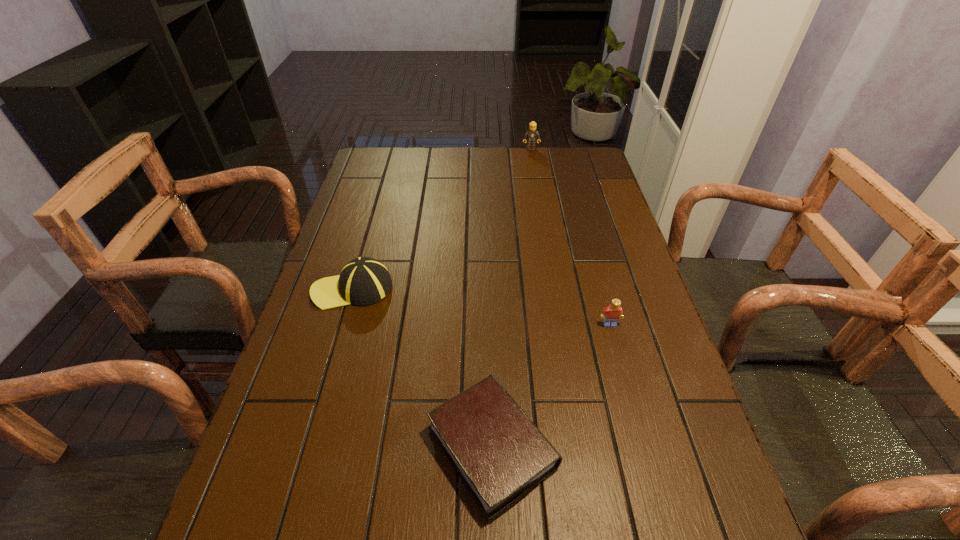
Find the location of a particular element. The width and height of the screenshot is (960, 540). blank space located 0.330m on the back of the third object from right to left is located at coordinates (489, 281).

This screenshot has height=540, width=960. What are the coordinates of `object situated at the far edge` in the screenshot? It's located at (531, 135).

The image size is (960, 540). I want to click on object at the left edge, so click(363, 281).

Locate an element on the screen. This screenshot has width=960, height=540. object situated at the right edge is located at coordinates (611, 314).

The width and height of the screenshot is (960, 540). I want to click on vacant area at the left edge, so click(358, 314).

Image resolution: width=960 pixels, height=540 pixels. In order to click on vacant space at the right edge in this screenshot , I will do `click(614, 335)`.

The image size is (960, 540). In the image, there is a desktop. Find the location of `vacant space at the far left corner`. vacant space at the far left corner is located at coordinates (373, 180).

At what (x,y) coordinates should I click in order to perform the action: click on free point between the third nearest object and the third object from left to right. Please return your answer as a coordinate pair (x, y). The width and height of the screenshot is (960, 540). Looking at the image, I should click on (442, 219).

The image size is (960, 540). Find the location of `vacant point located between the nearer Lego and the third nearest object`. vacant point located between the nearer Lego and the third nearest object is located at coordinates (481, 307).

Identify the location of empty space between the shorter Lego and the farthest object. (570, 237).